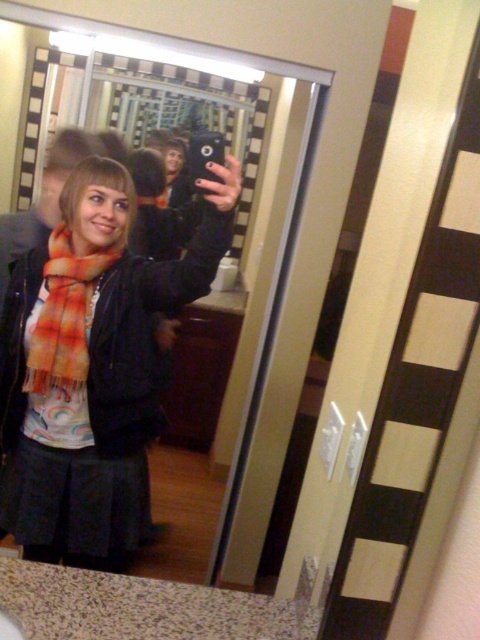
Question: Is orange plaid scarf at center above orange and white striped scarf at center?

Choices:
 (A) no
 (B) yes

Answer: (A)

Question: Which point is farther to the camera?

Choices:
 (A) (62, 365)
 (B) (9, 410)

Answer: (B)

Question: Can you confirm if orange plaid scarf at center is wider than orange and white striped scarf at center?

Choices:
 (A) yes
 (B) no

Answer: (A)

Question: Where is orange plaid scarf at center located in relation to orange and white striped scarf at center in the image?

Choices:
 (A) left
 (B) right

Answer: (B)